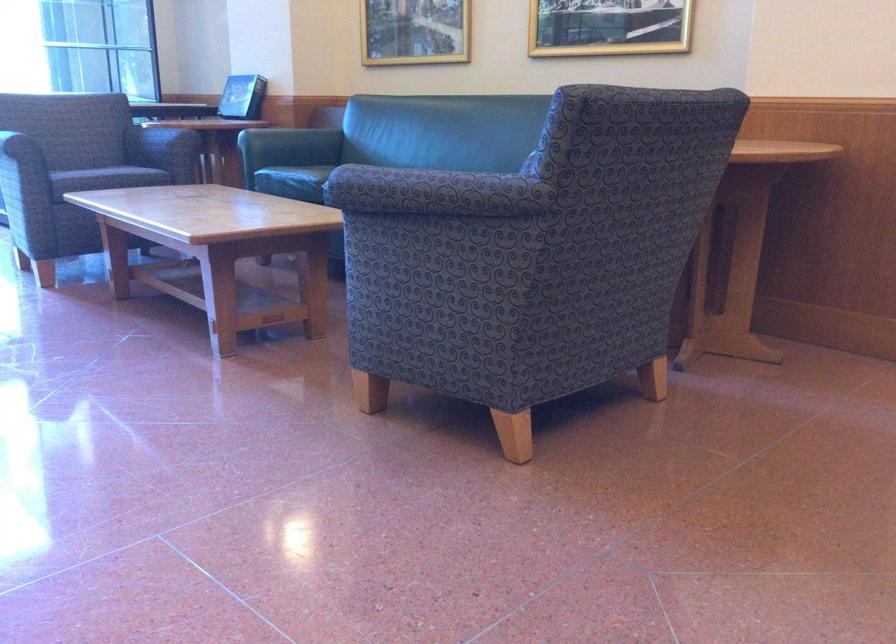
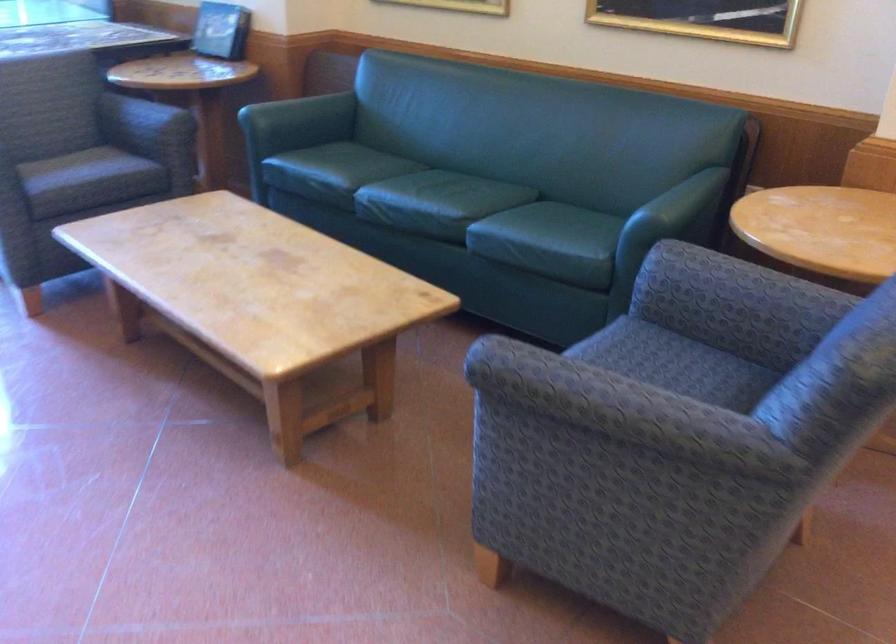
Question: Based on the continuous images, in which direction is the camera rotating? Reply with the corresponding letter.

Choices:
 (A) Left
 (B) Right
 (C) Up
 (D) Down

Answer: (D)